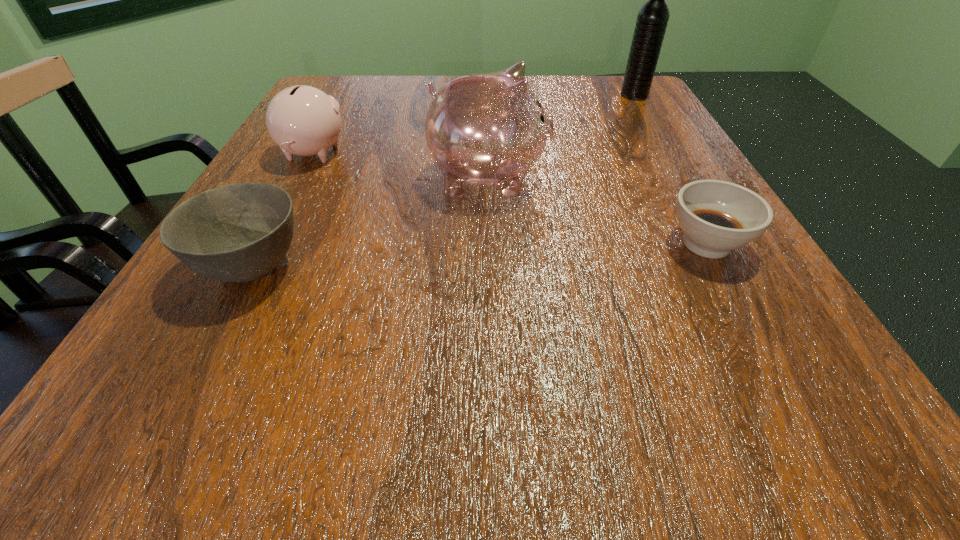
At what (x,y) coordinates should I click in order to perform the action: click on vacant space located 0.230m on the right of the bowl. Please return your answer as a coordinate pair (x, y). Looking at the image, I should click on (470, 266).

The image size is (960, 540). Find the location of `vacant space positioned 0.050m on the front of the shortest object`. vacant space positioned 0.050m on the front of the shortest object is located at coordinates (737, 299).

This screenshot has width=960, height=540. Find the location of `object that is positioned at the far edge`. object that is positioned at the far edge is located at coordinates (652, 19).

Locate an element on the screen. The image size is (960, 540). piggy bank situated at the left edge is located at coordinates (302, 120).

What are the coordinates of `bowl present at the left edge` in the screenshot? It's located at (240, 232).

Locate an element on the screen. The image size is (960, 540). water bottle that is positioned at the right edge is located at coordinates (652, 19).

Where is `soup bowl situated at the right edge`? Image resolution: width=960 pixels, height=540 pixels. soup bowl situated at the right edge is located at coordinates (716, 217).

At what (x,y) coordinates should I click in order to perform the action: click on object present at the far right corner. Please return your answer as a coordinate pair (x, y). The height and width of the screenshot is (540, 960). Looking at the image, I should click on coord(652,19).

Identify the location of free location at the far edge. (564, 111).

I want to click on free space at the near edge of the desktop, so coord(261,423).